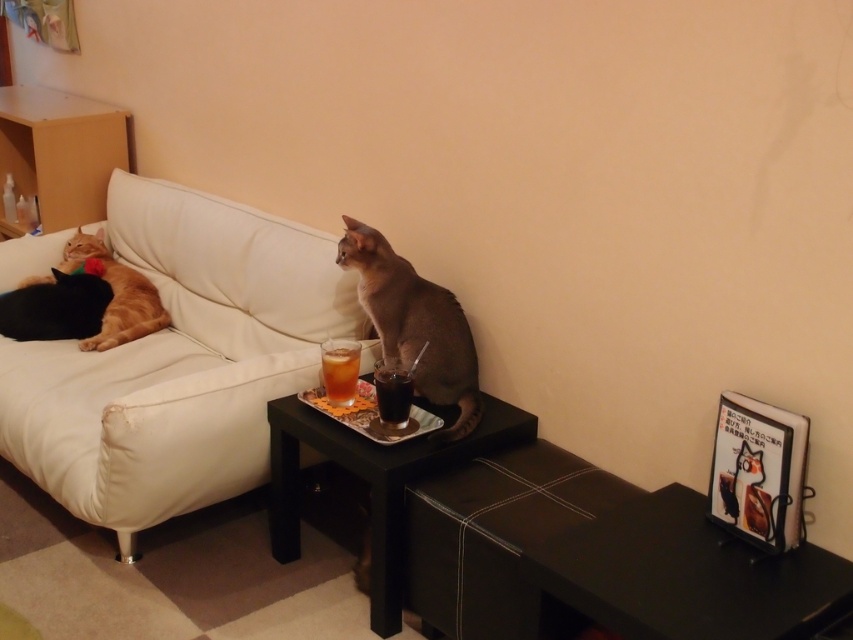
Can you confirm if silvery gray fur at center is thinner than translucent glass drink at center?

In fact, silvery gray fur at center might be wider than translucent glass drink at center.

Is silvery gray fur at center above translucent glass drink at center?

Indeed, silvery gray fur at center is positioned over translucent glass drink at center.

Does point (387, 317) lie behind point (349, 342)?

No, it is in front of (349, 342).

Identify the location of silvery gray fur at center. (415, 324).

Between point (16, 275) and point (422, 292), which one is positioned in front?

Point (422, 292)

Which of these two, white leather couch at upper left or silvery gray fur at center, stands taller?

With more height is white leather couch at upper left.

You are a GUI agent. You are given a task and a screenshot of the screen. Output one action in this format:
    pyautogui.click(x=<x>, y=<y>)
    Task: Click on the white leather couch at upper left
    The image size is (853, 640).
    Given the screenshot: What is the action you would take?
    pyautogui.click(x=178, y=360)

This screenshot has width=853, height=640. Identify the location of white leather couch at upper left. (178, 360).

Does silvery gray fur at center lie behind dark glass cup at center?

Yes, it is.

Based on the photo, does silvery gray fur at center have a greater width compared to dark glass cup at center?

Indeed, silvery gray fur at center has a greater width compared to dark glass cup at center.

Locate an element on the screen. This screenshot has height=640, width=853. silvery gray fur at center is located at coordinates (415, 324).

The height and width of the screenshot is (640, 853). I want to click on silvery gray fur at center, so click(415, 324).